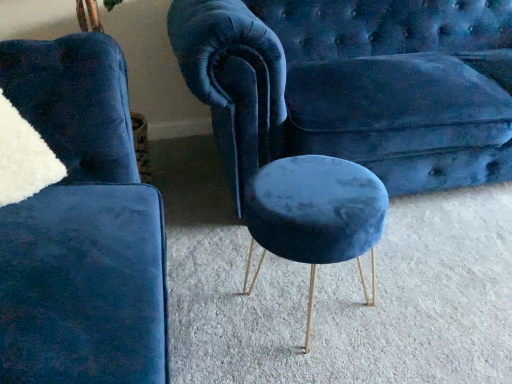
Question: Considering the relative positions of velvet blue couch at center and velvet blue stool at lower left in the image provided, is velvet blue couch at center to the right of velvet blue stool at lower left from the viewer's perspective?

Choices:
 (A) yes
 (B) no

Answer: (A)

Question: Is velvet blue couch at center positioned in front of velvet blue stool at lower left?

Choices:
 (A) no
 (B) yes

Answer: (A)

Question: Is velvet blue stool at lower left a part of velvet blue couch at center?

Choices:
 (A) yes
 (B) no

Answer: (B)

Question: Can you confirm if velvet blue couch at center is shorter than velvet blue stool at lower left?

Choices:
 (A) yes
 (B) no

Answer: (A)

Question: Could you tell me if velvet blue couch at center is turned towards velvet blue stool at lower left?

Choices:
 (A) yes
 (B) no

Answer: (B)

Question: Is velvet blue couch at center oriented away from velvet blue stool at lower left?

Choices:
 (A) no
 (B) yes

Answer: (A)

Question: Does velvet blue couch at center lie behind velvet blue stool at center?

Choices:
 (A) yes
 (B) no

Answer: (A)

Question: From the image's perspective, is velvet blue couch at center below velvet blue stool at center?

Choices:
 (A) no
 (B) yes

Answer: (A)

Question: From the image's perspective, would you say velvet blue couch at center is positioned over velvet blue stool at center?

Choices:
 (A) yes
 (B) no

Answer: (A)

Question: Does velvet blue couch at center have a greater height compared to velvet blue stool at center?

Choices:
 (A) yes
 (B) no

Answer: (A)

Question: Is velvet blue couch at center with velvet blue stool at center?

Choices:
 (A) yes
 (B) no

Answer: (B)

Question: Considering the relative positions of velvet blue couch at center and velvet blue stool at center in the image provided, is velvet blue couch at center to the left of velvet blue stool at center from the viewer's perspective?

Choices:
 (A) no
 (B) yes

Answer: (A)

Question: Does velvet blue stool at center have a greater width compared to velvet blue stool at lower left?

Choices:
 (A) no
 (B) yes

Answer: (A)